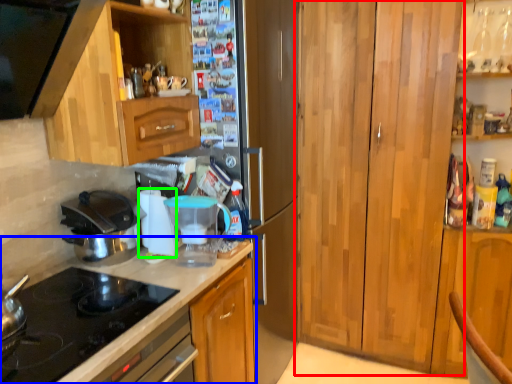
Question: Which object is the closest to the cabinetry (highlighted by a red box)? Choose among these: countertop (highlighted by a blue box) or appliance (highlighted by a green box).

Choices:
 (A) countertop
 (B) appliance

Answer: (A)